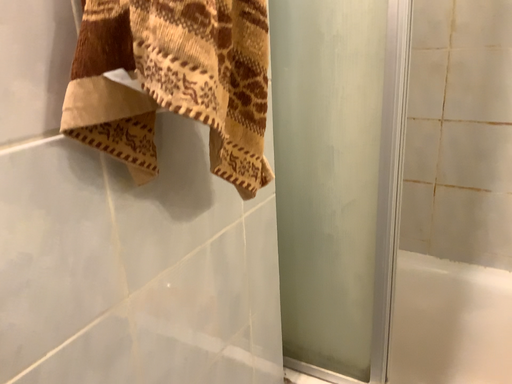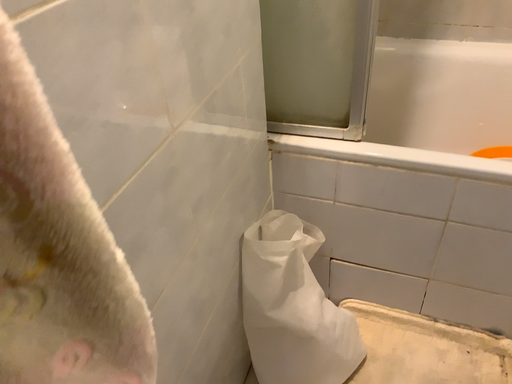
Question: Which way did the camera rotate in the video?

Choices:
 (A) rotated left
 (B) rotated right

Answer: (B)